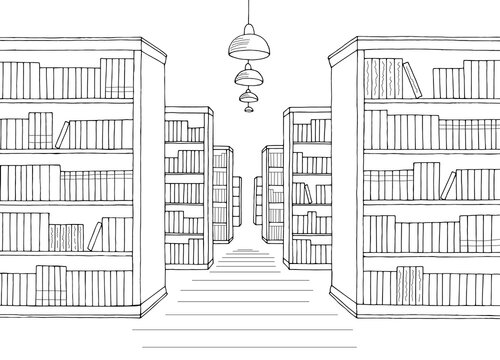
Where is `ceiling lights`? ceiling lights is located at coordinates [246, 45], [254, 76], [250, 96], [248, 109].